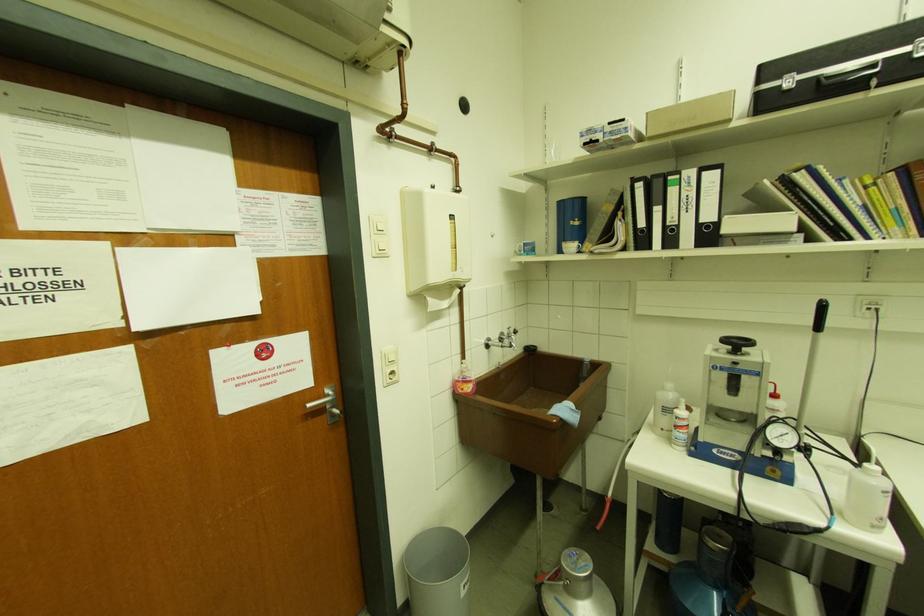
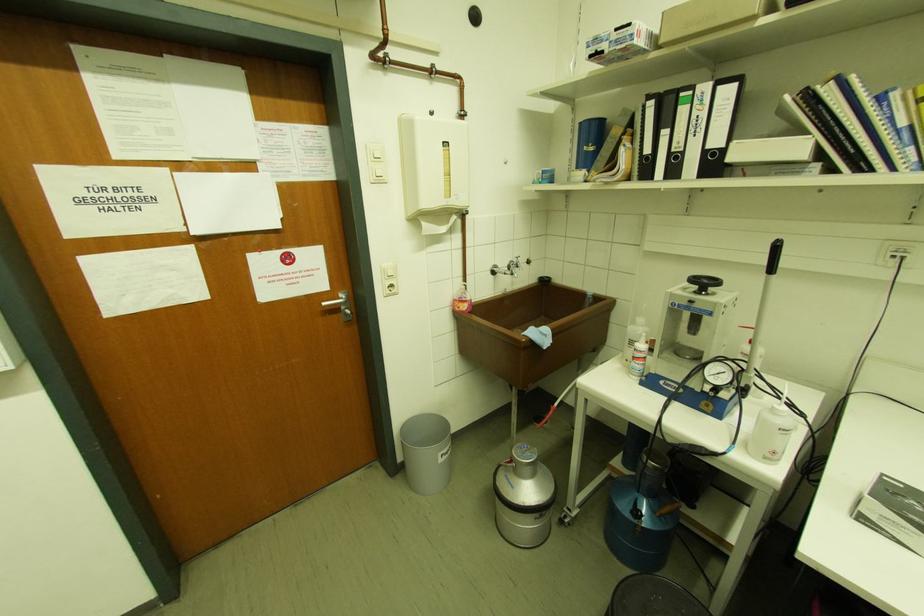
The point at (501, 339) is marked in the first image. Where is the corresponding point in the second image?

(509, 267)